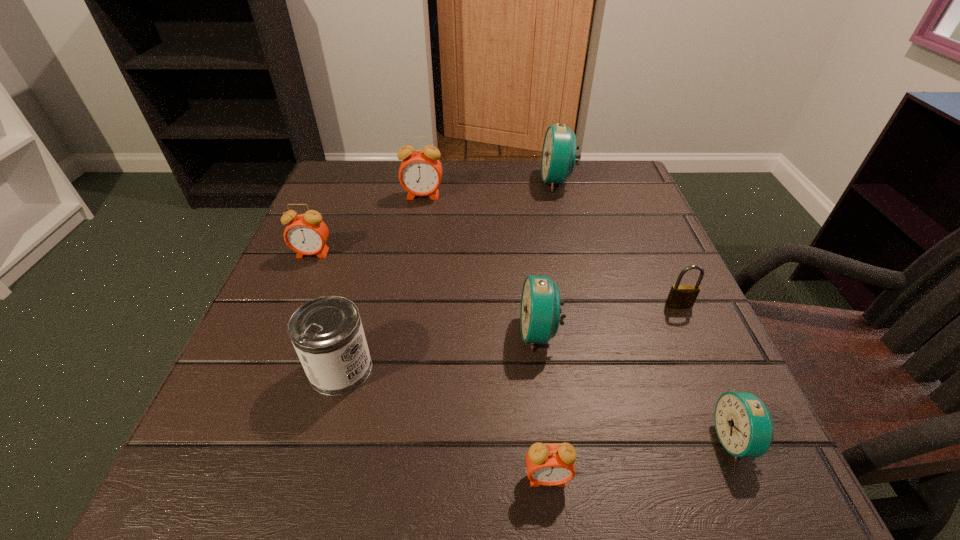
The width and height of the screenshot is (960, 540). Identify the location of free space located on the front-facing side of the fourth farthest alarm clock. coord(397,333).

Locate an element on the screen. The width and height of the screenshot is (960, 540). vacant space located 0.340m on the face of the third farthest alarm clock is located at coordinates tap(246, 409).

Where is `free space located on the back of the can`? This screenshot has height=540, width=960. free space located on the back of the can is located at coordinates (371, 262).

Locate an element on the screen. Image resolution: width=960 pixels, height=540 pixels. vacant space located on the back of the padlock is located at coordinates (652, 247).

This screenshot has width=960, height=540. Find the location of `free region located on the front-facing side of the rightmost alarm clock`. free region located on the front-facing side of the rightmost alarm clock is located at coordinates (466, 440).

The image size is (960, 540). I want to click on free location located on the front-facing side of the rightmost alarm clock, so click(609, 440).

Where is `blank area located on the front-facing side of the rightmost alarm clock`? The width and height of the screenshot is (960, 540). blank area located on the front-facing side of the rightmost alarm clock is located at coordinates (459, 440).

Identify the location of alarm clock that is at the left edge. (306, 234).

At what (x,y) coordinates should I click in order to perform the action: click on can at the left edge. Please return your answer as a coordinate pair (x, y). Looking at the image, I should click on (327, 334).

Find the location of a particular element. This screenshot has width=960, height=540. padlock positioned at the right edge is located at coordinates (680, 296).